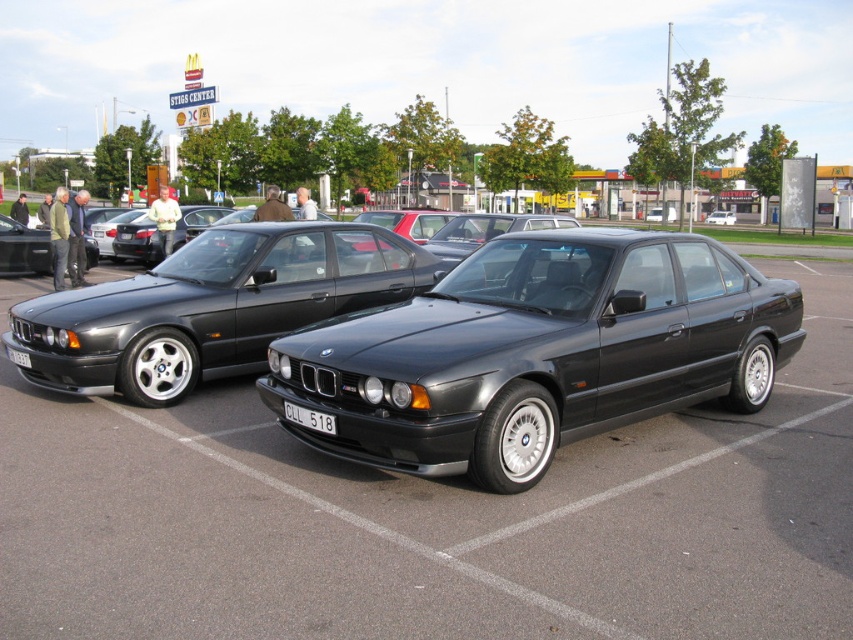
Question: Where is matte black sedan at center located in relation to black plastic license plate at center in the image?

Choices:
 (A) above
 (B) below

Answer: (A)

Question: In this image, where is matte black sedan at center located relative to black metallic sedan at center?

Choices:
 (A) left
 (B) right

Answer: (A)

Question: Estimate the real-world distances between objects in this image. Which object is farther from the shiny black sedan at center?

Choices:
 (A) black plastic license plate at center
 (B) satin black car at center
 (C) white plastic license plate at lower left

Answer: (A)

Question: Where is satin black car at center located in relation to shiny black sedan at center in the image?

Choices:
 (A) above
 (B) below

Answer: (B)

Question: Which of the following is the farthest from the observer?

Choices:
 (A) (x=13, y=358)
 (B) (x=329, y=426)

Answer: (A)

Question: Which point is closer to the camera?

Choices:
 (A) (9, 358)
 (B) (729, 221)
 (C) (239, 282)
 (D) (306, 410)

Answer: (D)